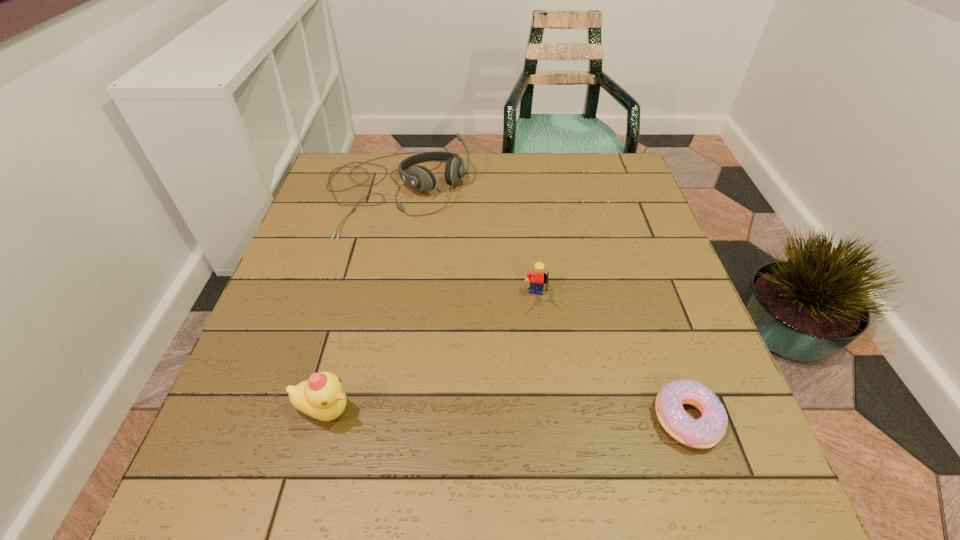
This screenshot has width=960, height=540. I want to click on free space between the headset and the duckling, so click(361, 301).

Where is `blank region between the third object from left to right and the farthest object`? Image resolution: width=960 pixels, height=540 pixels. blank region between the third object from left to right and the farthest object is located at coordinates (466, 246).

You are a GUI agent. You are given a task and a screenshot of the screen. Output one action in this format:
    pyautogui.click(x=<x>, y=<y>)
    Task: Click on the vacant area that lies between the duckling and the Lego
    The width and height of the screenshot is (960, 540).
    Given the screenshot: What is the action you would take?
    pyautogui.click(x=430, y=355)

Where is `blank region between the headset and the Lego`? blank region between the headset and the Lego is located at coordinates (466, 246).

The image size is (960, 540). Identify the location of unoccupied area between the headset and the doughnut. (541, 305).

Locate an element on the screen. The image size is (960, 540). empty location between the duckling and the headset is located at coordinates (361, 301).

Locate an element on the screen. This screenshot has height=540, width=960. vacant space that is in between the Lego and the shortest object is located at coordinates (612, 359).

Find the location of a particular element. unoccupied position between the third object from left to right and the farthest object is located at coordinates [x=466, y=246].

This screenshot has width=960, height=540. I want to click on the closest object to the headset, so click(x=537, y=278).

In order to click on object that is the second nearest to the farthest object in this screenshot , I will do `click(321, 396)`.